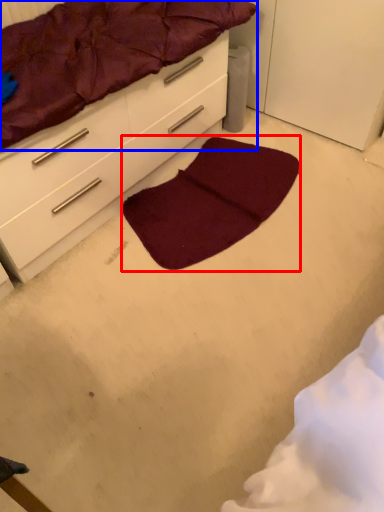
Question: Which object is closer to the camera taking this photo, mat (highlighted by a red box) or mattress (highlighted by a blue box)?

Choices:
 (A) mat
 (B) mattress

Answer: (B)